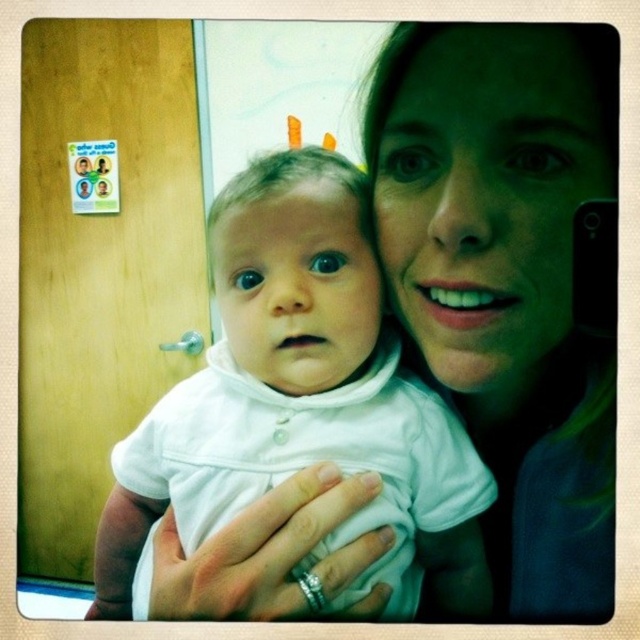
Does matte white shirt at center have a smaller size compared to white matte baby at center?

Yes, matte white shirt at center is smaller than white matte baby at center.

Who is higher up, matte white shirt at center or white matte baby at center?

matte white shirt at center is above.

Which is in front, point (420, 88) or point (326, 456)?

Point (420, 88)

Identify the location of matte white shirt at center. The width and height of the screenshot is (640, 640). (508, 276).